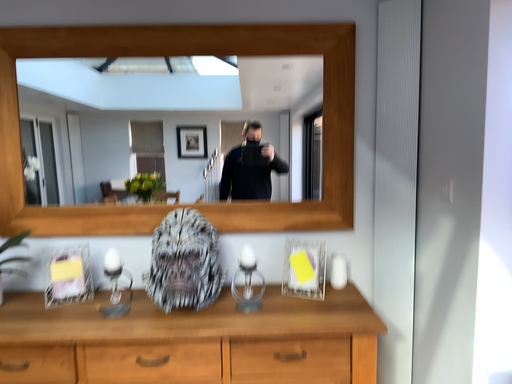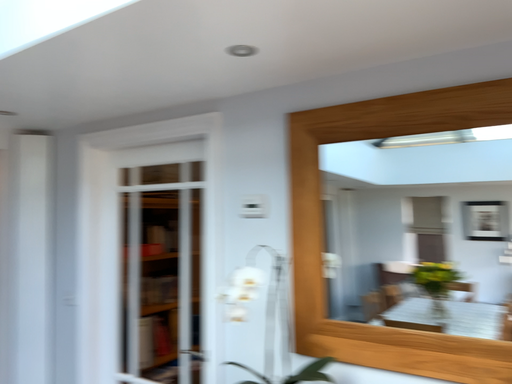
Question: How did the camera likely rotate when shooting the video?

Choices:
 (A) rotated right
 (B) rotated left

Answer: (B)